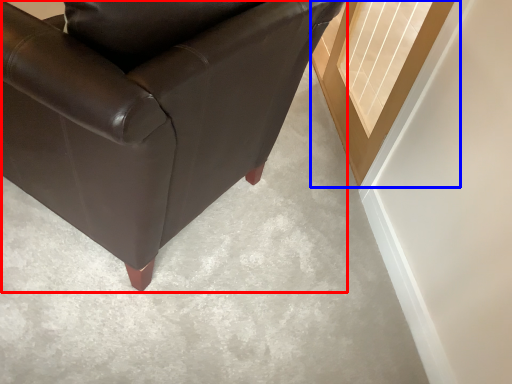
Question: Which object is closer to the camera taking this photo, chair (highlighted by a red box) or window (highlighted by a blue box)?

Choices:
 (A) chair
 (B) window

Answer: (A)